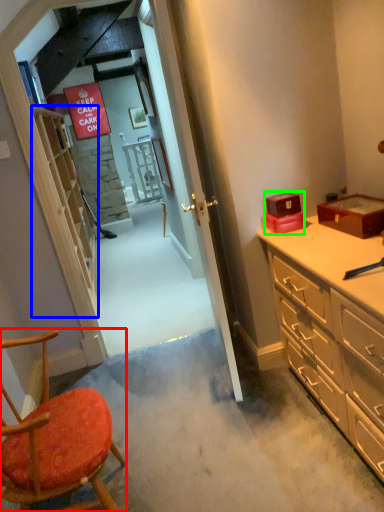
Question: Which object is positioned closest to chair (highlighted by a red box)? Select from shelf (highlighted by a blue box) and box (highlighted by a green box).

Choices:
 (A) shelf
 (B) box

Answer: (B)